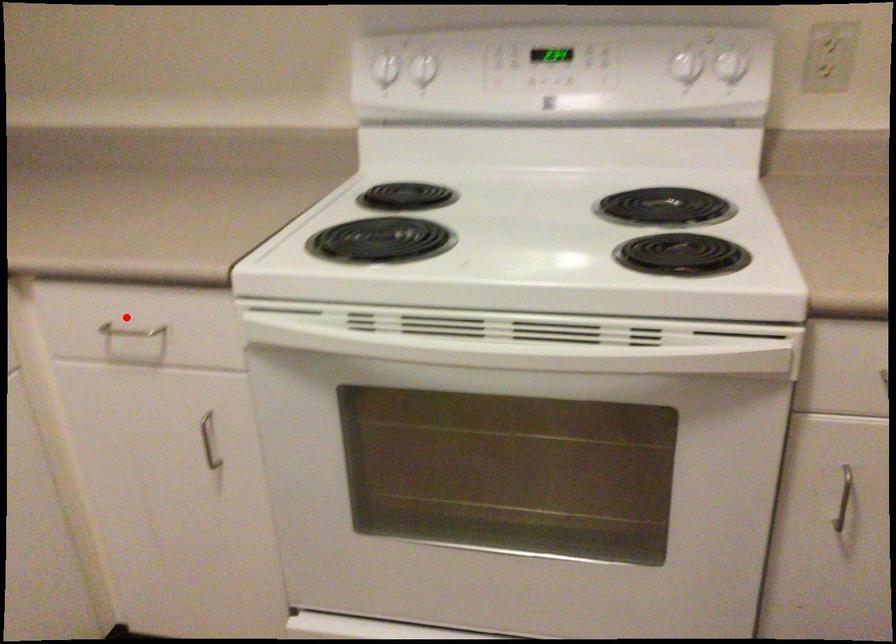
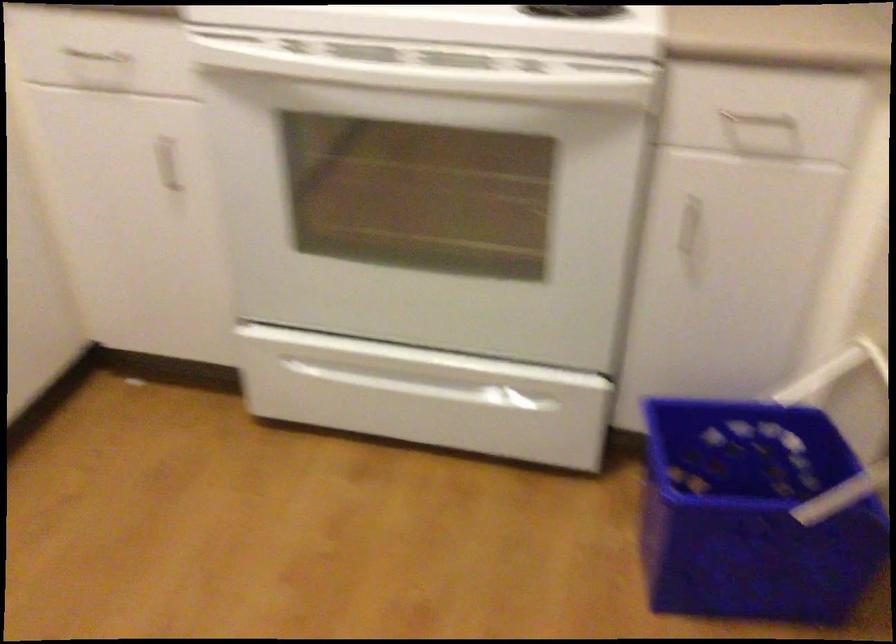
Question: I am providing you with two images of the same scene from different viewpoints. A red point is shown in image1. For the corresponding object point in image2, is it positioned nearer or farther from the camera?

Choices:
 (A) Nearer
 (B) Farther

Answer: (B)